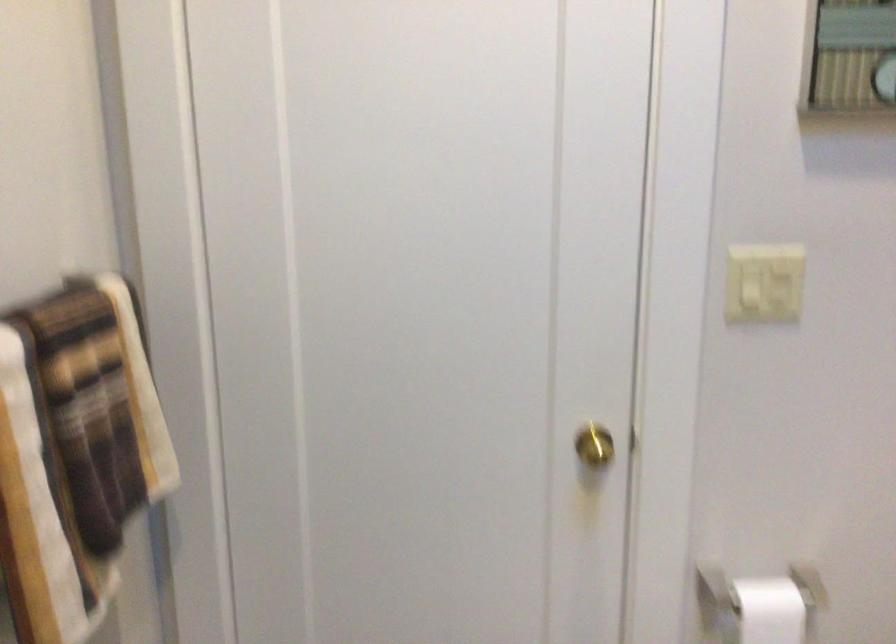
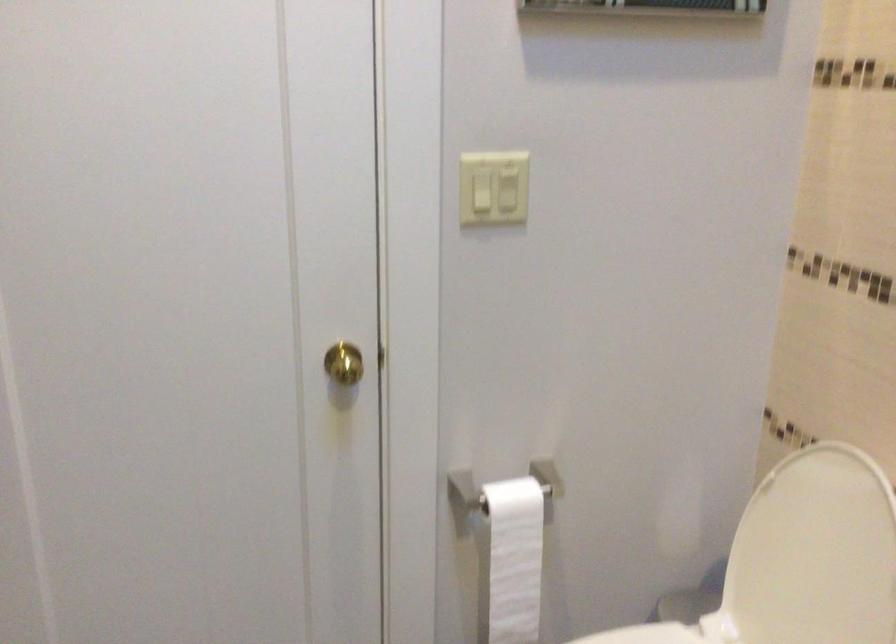
Find the pixel in the second image that matches (x=748, y=279) in the first image.

(480, 191)